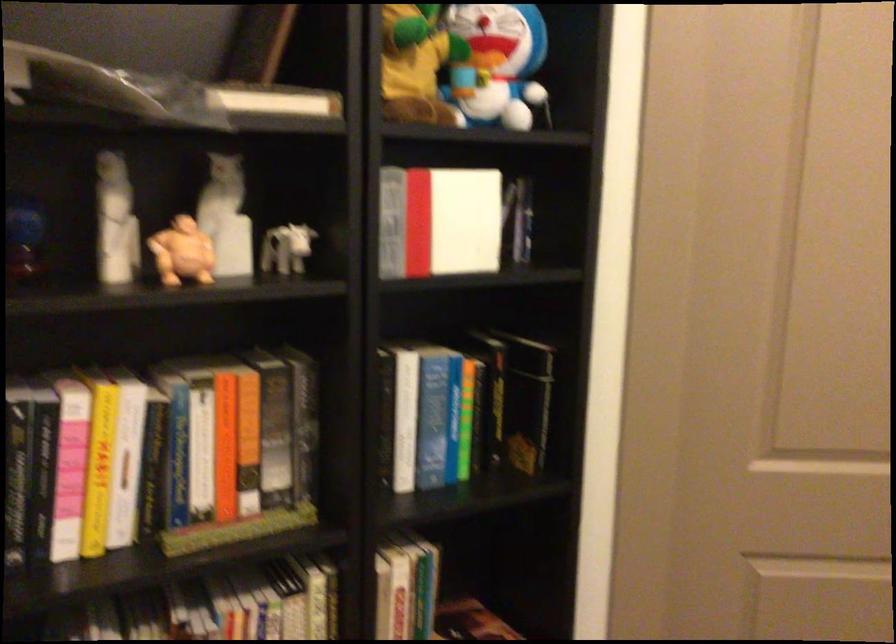
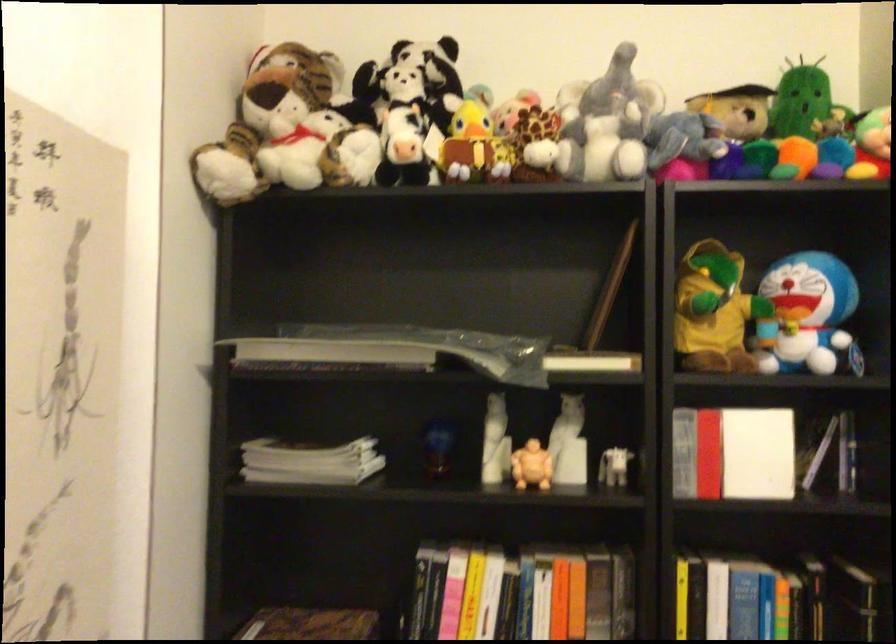
Find the pixel in the second image that matches (460,222) in the first image.

(757, 453)